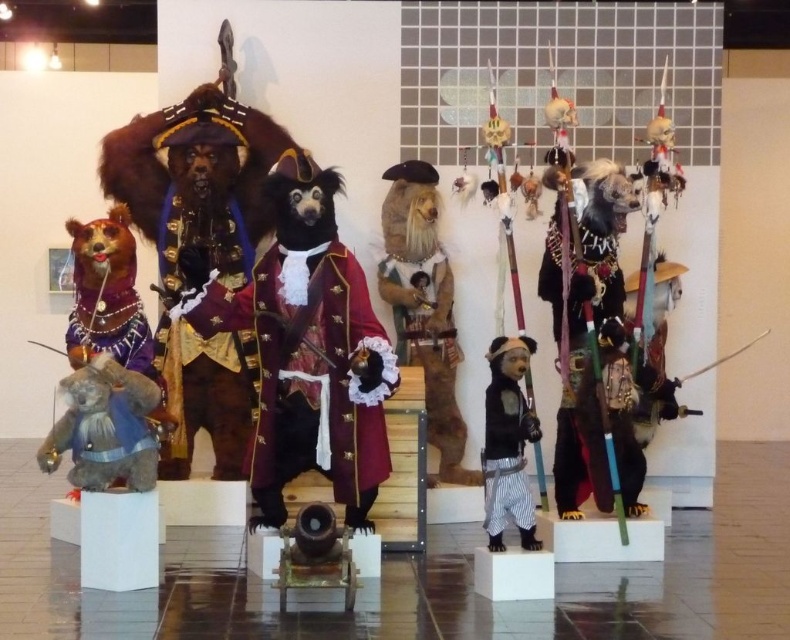
You are standing in the exhibition space and want to move from the point marked at coordinates point (450, 401) to the point marked at coordinates point (134, 472). Which direction should you move in to reach your destination?

To move from point (450, 401) to point (134, 472), you should move downward and to the right since point (134, 472) is located below and to the right of point (450, 401).

Looking at the exhibition of bears in costumes, there is a furry costume at center and a matte black bear at center. From the perspective of someone standing in front of the display, which bear is positioned to the left?

The furry costume at center is positioned to the left of the matte black bear at center.

What is located at the coordinates point (309, 349) in the image?

The velvet maroon coat at center is located at point (309, 349).